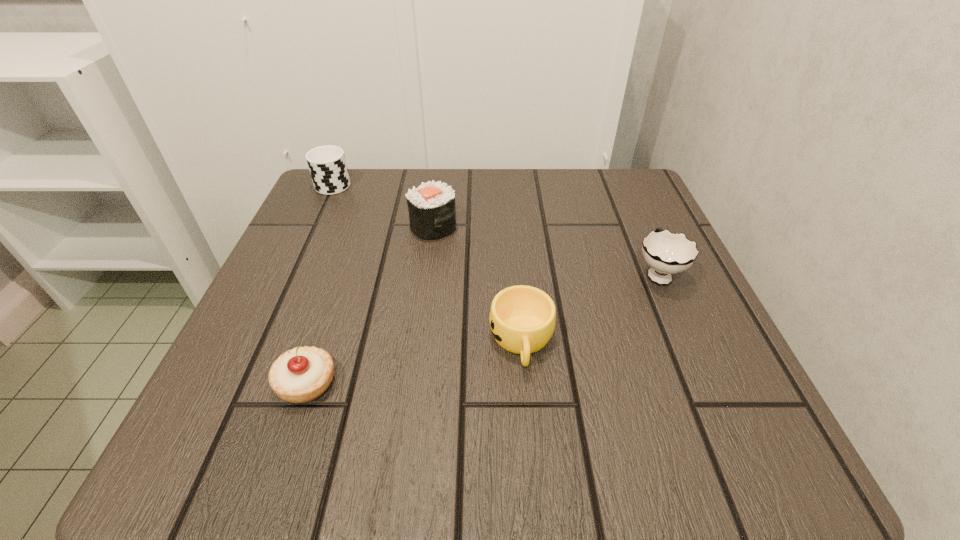
The height and width of the screenshot is (540, 960). I want to click on object at the right edge, so click(667, 253).

You are a GUI agent. You are given a task and a screenshot of the screen. Output one action in this format:
    pyautogui.click(x=<x>, y=<y>)
    Task: Click on the object at the far left corner
    The width and height of the screenshot is (960, 540).
    Given the screenshot: What is the action you would take?
    pyautogui.click(x=327, y=165)

In order to click on object positioned at the near left corner in this screenshot , I will do `click(302, 374)`.

Locate an element on the screen. Image resolution: width=960 pixels, height=540 pixels. vacant area at the near edge of the desktop is located at coordinates (523, 462).

This screenshot has height=540, width=960. I want to click on vacant space at the left edge, so pos(284,262).

You are a GUI agent. You are given a task and a screenshot of the screen. Output one action in this format:
    pyautogui.click(x=<x>, y=<y>)
    Task: Click on the free space at the right edge of the desktop
    The height and width of the screenshot is (540, 960).
    Given the screenshot: What is the action you would take?
    pyautogui.click(x=645, y=308)

At what (x,y) coordinates should I click in order to perform the action: click on vacant space at the far left corner of the desktop. Please return your answer as a coordinate pair (x, y). The width and height of the screenshot is (960, 540). Looking at the image, I should click on (316, 199).

This screenshot has width=960, height=540. Find the location of `free point at the near left corner`. free point at the near left corner is located at coordinates (238, 440).

The image size is (960, 540). In the image, there is a desktop. In order to click on vacant space at the far right corner in this screenshot , I will do `click(582, 167)`.

Where is `vacant region at the near right corner of the desktop`? vacant region at the near right corner of the desktop is located at coordinates point(736,435).